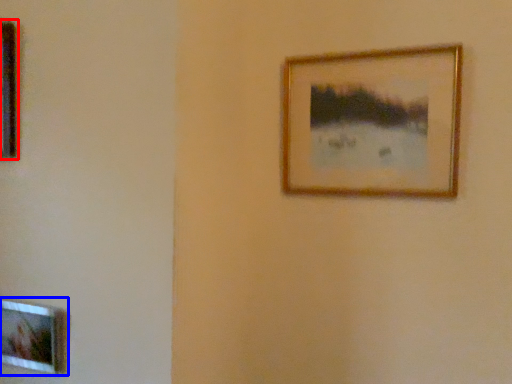
Question: Which of the following is the farthest to the observer, picture frame (highlighted by a red box) or picture frame (highlighted by a blue box)?

Choices:
 (A) picture frame
 (B) picture frame

Answer: (B)